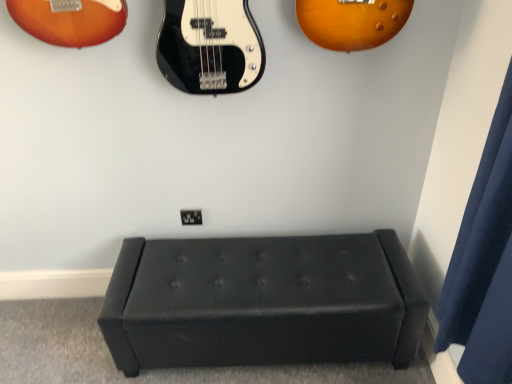
I want to click on black leather ottoman at center, so click(x=262, y=302).

Image resolution: width=512 pixels, height=384 pixels. What do you see at coordinates (262, 302) in the screenshot?
I see `black leather ottoman at center` at bounding box center [262, 302].

Measure the distance between point (288, 288) and camera.

Point (288, 288) and camera are 4.71 feet apart from each other.

What do you see at coordinates (484, 263) in the screenshot?
I see `dark blue fabric curtain at right` at bounding box center [484, 263].

I want to click on dark blue fabric curtain at right, so click(484, 263).

The width and height of the screenshot is (512, 384). I want to click on black leather ottoman at center, so click(x=262, y=302).

Which object is positioned more to the left, dark blue fabric curtain at right or black leather ottoman at center?

From the viewer's perspective, black leather ottoman at center appears more on the left side.

In the image, is dark blue fabric curtain at right positioned in front of or behind black leather ottoman at center?

Visually, dark blue fabric curtain at right is located in front of black leather ottoman at center.

Which point is more distant from viewer, (446,334) or (317,332)?

The point (317,332) is farther.

Looking at this image, from the image's perspective, relative to black leather ottoman at center, is dark blue fabric curtain at right above or below?

dark blue fabric curtain at right is above black leather ottoman at center.

From a real-world perspective, is dark blue fabric curtain at right physically above black leather ottoman at center?

Yes, from a real-world perspective, dark blue fabric curtain at right is over black leather ottoman at center

Which object is wider, dark blue fabric curtain at right or black leather ottoman at center?

black leather ottoman at center.

Between dark blue fabric curtain at right and black leather ottoman at center, which one has more height?

Standing taller between the two is dark blue fabric curtain at right.

Considering the relative sizes of dark blue fabric curtain at right and black leather ottoman at center in the image provided, is dark blue fabric curtain at right smaller than black leather ottoman at center?

Yes.

Is dark blue fabric curtain at right surrounding black leather ottoman at center?

No, dark blue fabric curtain at right does not contain black leather ottoman at center.

Is dark blue fabric curtain at right next to black leather ottoman at center and touching it?

dark blue fabric curtain at right and black leather ottoman at center are not in contact.

Is dark blue fabric curtain at right oriented away from black leather ottoman at center?

That's not correct — dark blue fabric curtain at right is not looking away from black leather ottoman at center.

Can you tell me how much dark blue fabric curtain at right and black leather ottoman at center differ in facing direction?

The facing directions of dark blue fabric curtain at right and black leather ottoman at center are 89.8 degrees apart.

Where is `furniture lying on the left of dark blue fabric curtain at right`? This screenshot has width=512, height=384. furniture lying on the left of dark blue fabric curtain at right is located at coordinates (262, 302).

Which object is positioned more to the left, black leather ottoman at center or dark blue fabric curtain at right?

Positioned to the left is black leather ottoman at center.

Relative to dark blue fabric curtain at right, is black leather ottoman at center in front or behind?

black leather ottoman at center is behind dark blue fabric curtain at right.

Is point (311, 314) positioned before point (493, 341)?

No, (311, 314) is further to viewer.

From the image's perspective, between black leather ottoman at center and dark blue fabric curtain at right, who is located below?

black leather ottoman at center appears lower in the image.

From a real-world perspective, is black leather ottoman at center below dark blue fabric curtain at right?

Yes.

Is black leather ottoman at center thinner than dark blue fabric curtain at right?

In fact, black leather ottoman at center might be wider than dark blue fabric curtain at right.

Is black leather ottoman at center taller or shorter than dark blue fabric curtain at right?

Clearly, black leather ottoman at center is shorter compared to dark blue fabric curtain at right.

Does black leather ottoman at center have a smaller size compared to dark blue fabric curtain at right?

No, black leather ottoman at center is not smaller than dark blue fabric curtain at right.

Is black leather ottoman at center not inside dark blue fabric curtain at right?

Yes, black leather ottoman at center is outside of dark blue fabric curtain at right.

Are black leather ottoman at center and dark blue fabric curtain at right beside each other?

No, black leather ottoman at center is not beside dark blue fabric curtain at right.

Is black leather ottoman at center oriented away from dark blue fabric curtain at right?

That's not correct — black leather ottoman at center is not looking away from dark blue fabric curtain at right.

This screenshot has height=384, width=512. In order to click on furniture below the dark blue fabric curtain at right (from a real-world perspective) in this screenshot , I will do coord(262,302).

Image resolution: width=512 pixels, height=384 pixels. I want to click on furniture lying below the dark blue fabric curtain at right (from the image's perspective), so click(262, 302).

Where is `curtain above the black leather ottoman at center (from a real-world perspective)`? curtain above the black leather ottoman at center (from a real-world perspective) is located at coordinates (484, 263).